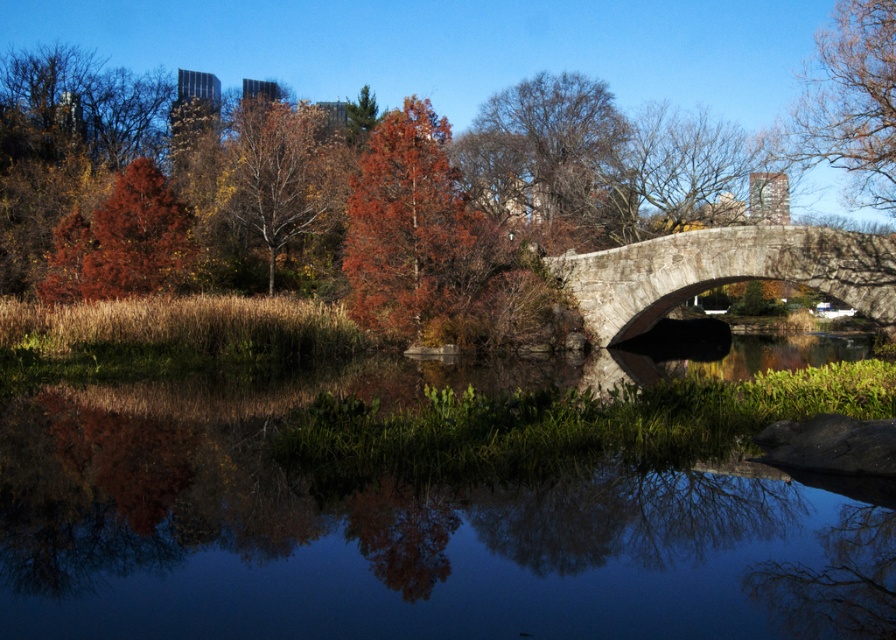
Question: Which of these objects is positioned closest to the orange matte tree at center?

Choices:
 (A) orange-brown bark tree at upper center
 (B) gray stone bridge at right

Answer: (B)

Question: Among these points, which one is farthest from the camera?

Choices:
 (A) (711, 68)
 (B) (608, 339)
 (C) (507, 189)
 (D) (338, 182)

Answer: (A)

Question: Considering the real-world distances, which object is closest to the gray stone bridge at right?

Choices:
 (A) bare branches at upper center
 (B) orange-brown bark tree at upper center

Answer: (A)

Question: Does gray stone bridge at right appear under orange-brown bark tree at upper center?

Choices:
 (A) no
 (B) yes

Answer: (B)

Question: Does gray stone bridge at right have a lesser width compared to orange-brown bark tree at upper center?

Choices:
 (A) yes
 (B) no

Answer: (A)

Question: Can you confirm if bare branches at upper center is positioned to the left of orange-brown bark tree at upper center?

Choices:
 (A) no
 (B) yes

Answer: (A)